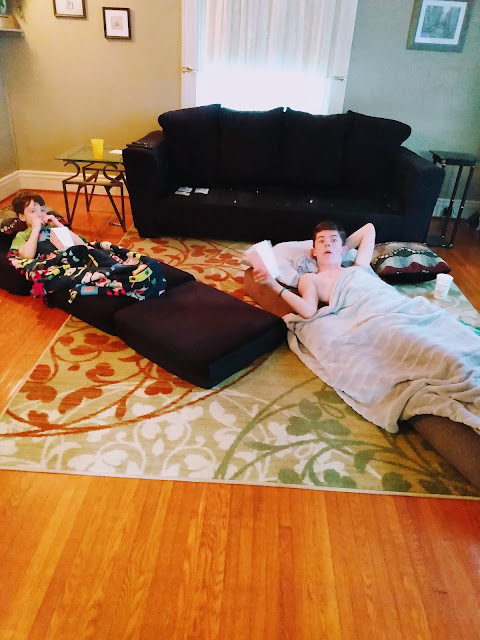
Where is `doors`? doors is located at coordinates (194, 35), (336, 49).